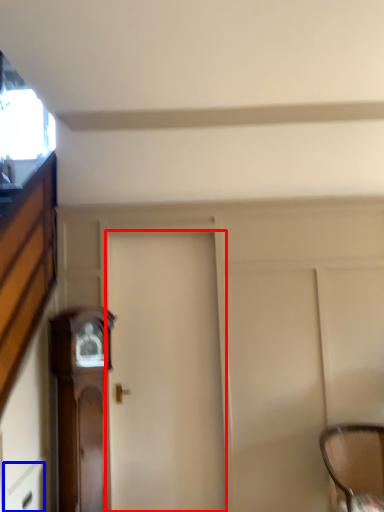
Question: Which object is further to the camera taking this photo, door (highlighted by a red box) or drawer (highlighted by a blue box)?

Choices:
 (A) door
 (B) drawer

Answer: (A)